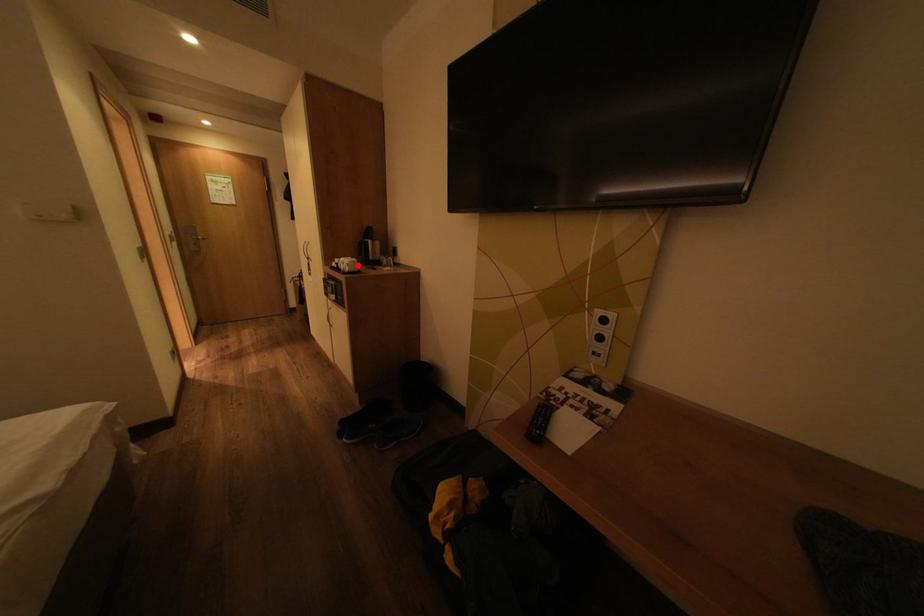
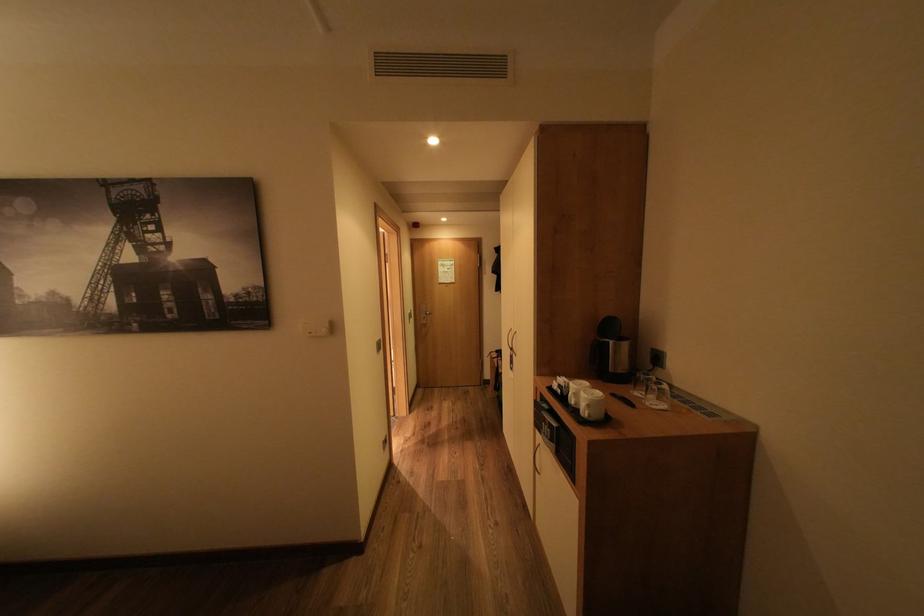
In the second image, find the point that corresponds to the highlighted location in the first image.

(600, 406)